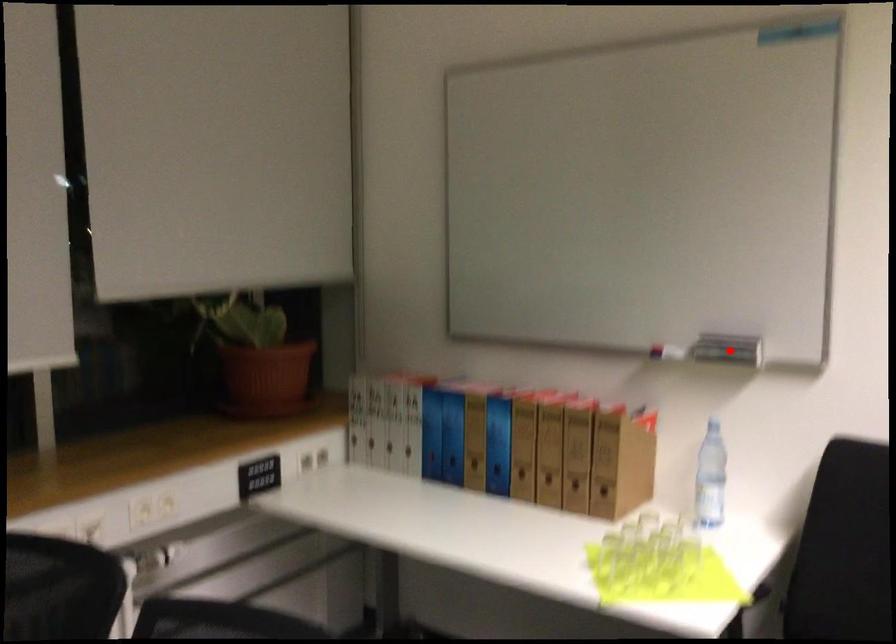
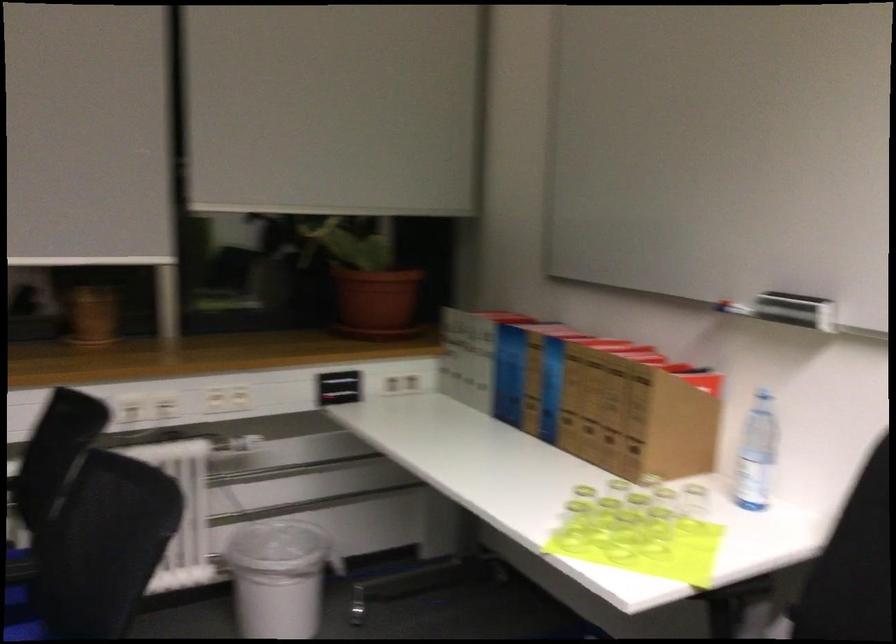
In the second image, find the point that corresponds to the highlighted location in the first image.

(795, 310)